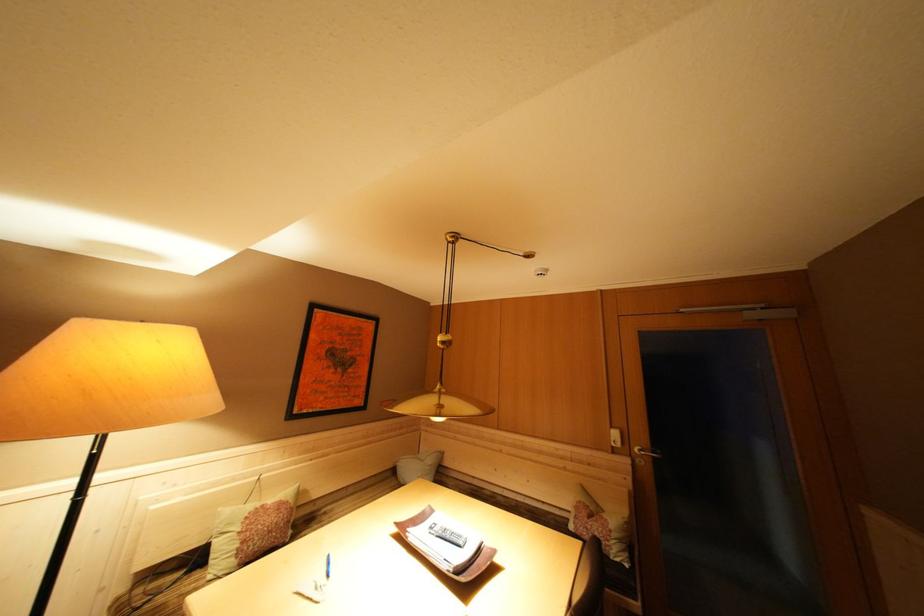
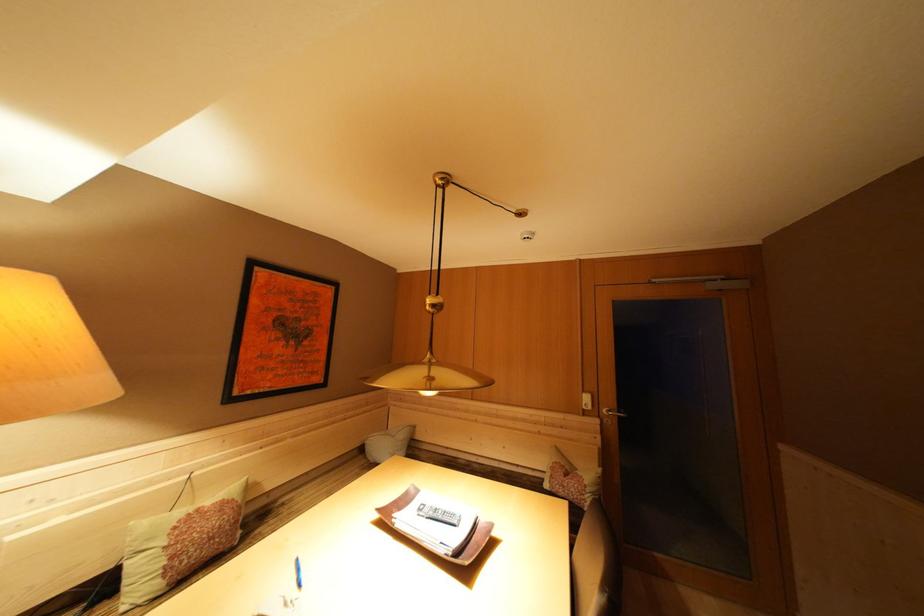
Locate, in the second image, the point that corresponds to (x=271, y=511) in the first image.

(204, 515)